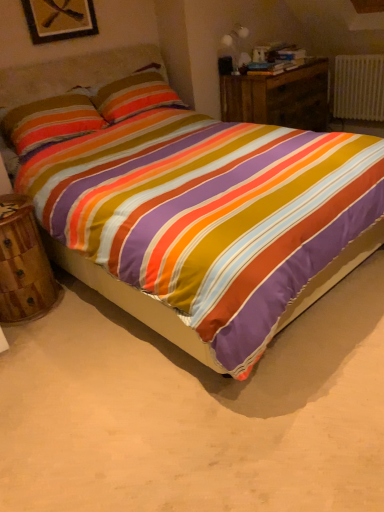
Question: Is white plastic radiator at upper right closer to camera compared to matte white table lamp at upper right?

Choices:
 (A) no
 (B) yes

Answer: (A)

Question: Can you confirm if white plastic radiator at upper right is bigger than matte white table lamp at upper right?

Choices:
 (A) yes
 (B) no

Answer: (A)

Question: Is white plastic radiator at upper right wider than matte white table lamp at upper right?

Choices:
 (A) no
 (B) yes

Answer: (A)

Question: Does white plastic radiator at upper right turn towards matte white table lamp at upper right?

Choices:
 (A) no
 (B) yes

Answer: (B)

Question: From the image's perspective, is white plastic radiator at upper right located beneath matte white table lamp at upper right?

Choices:
 (A) no
 (B) yes

Answer: (B)

Question: Is white plastic radiator at upper right turned away from matte white table lamp at upper right?

Choices:
 (A) no
 (B) yes

Answer: (A)

Question: Is matte white table lamp at upper right to the right of wooden nightstand at lower left, which is the 1th nightstand from front to back, from the viewer's perspective?

Choices:
 (A) yes
 (B) no

Answer: (A)

Question: From the image's perspective, is matte white table lamp at upper right over wooden nightstand at lower left, positioned as the first nightstand in left-to-right order?

Choices:
 (A) yes
 (B) no

Answer: (A)

Question: Is matte white table lamp at upper right not inside wooden nightstand at lower left, arranged as the second nightstand when viewed from the back?

Choices:
 (A) yes
 (B) no

Answer: (A)

Question: Is matte white table lamp at upper right shorter than wooden nightstand at lower left, arranged as the second nightstand when viewed from the back?

Choices:
 (A) yes
 (B) no

Answer: (A)

Question: From the image's perspective, is matte white table lamp at upper right under wooden nightstand at lower left, the 1th nightstand in the bottom-to-top sequence?

Choices:
 (A) no
 (B) yes

Answer: (A)

Question: Can you confirm if matte white table lamp at upper right is thinner than wooden nightstand at lower left, the 1th nightstand in the bottom-to-top sequence?

Choices:
 (A) yes
 (B) no

Answer: (A)

Question: Does wooden nightstand at center, marked as the second nightstand in a front-to-back arrangement, come in front of textured cotton pillow at upper left?

Choices:
 (A) no
 (B) yes

Answer: (A)